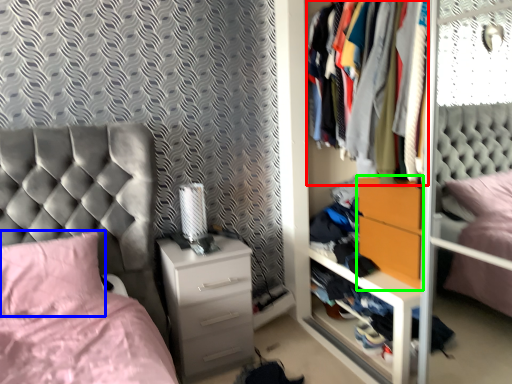
Question: Considering the real-world distances, which object is closest to clothing (highlighted by a red box)? pillow (highlighted by a blue box) or nightstand (highlighted by a green box).

Choices:
 (A) pillow
 (B) nightstand

Answer: (B)